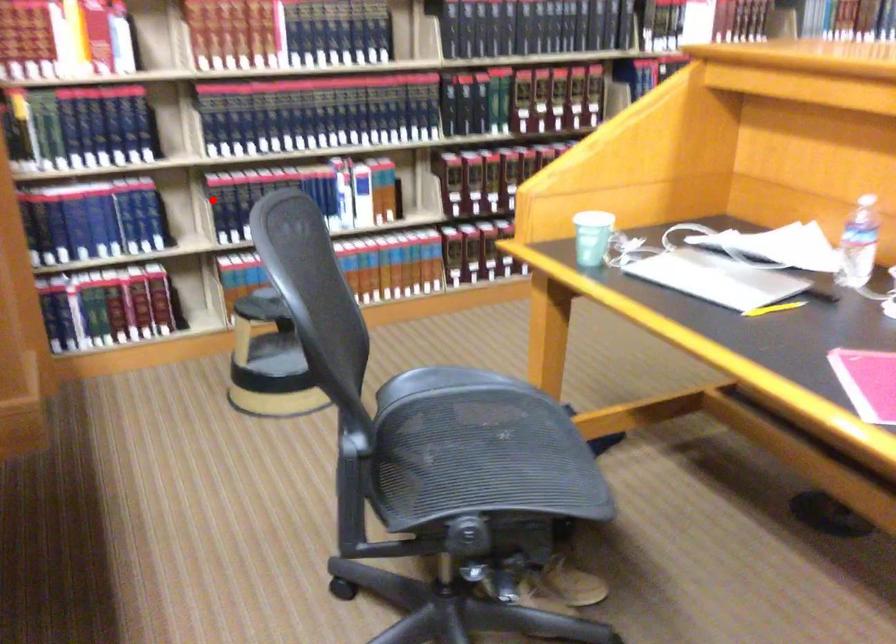
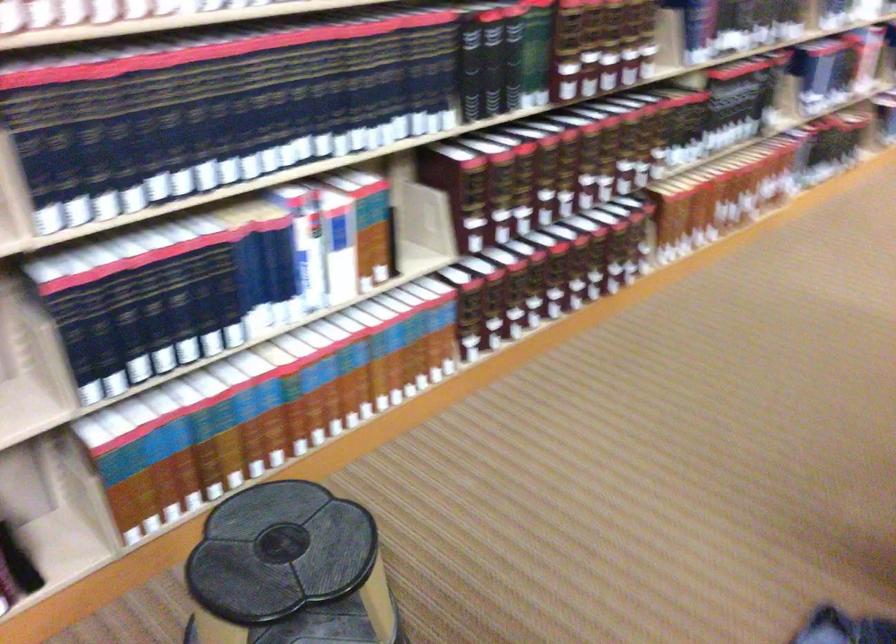
Locate, in the second image, the point that corresponds to the highlighted location in the first image.

(85, 325)